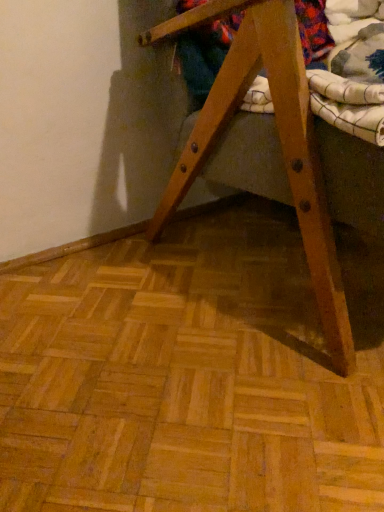
Question: Does wooden folding chair at center turn towards floral fabric at upper right?

Choices:
 (A) yes
 (B) no

Answer: (B)

Question: Does wooden folding chair at center have a larger size compared to floral fabric at upper right?

Choices:
 (A) no
 (B) yes

Answer: (B)

Question: Is wooden folding chair at center thinner than floral fabric at upper right?

Choices:
 (A) no
 (B) yes

Answer: (A)

Question: Does wooden folding chair at center have a greater height compared to floral fabric at upper right?

Choices:
 (A) no
 (B) yes

Answer: (B)

Question: Is wooden folding chair at center not within floral fabric at upper right?

Choices:
 (A) no
 (B) yes

Answer: (B)

Question: From a real-world perspective, is wooden folding chair at center located higher than floral fabric at upper right?

Choices:
 (A) no
 (B) yes

Answer: (A)

Question: Is floral fabric at upper right outside wooden folding chair at center?

Choices:
 (A) no
 (B) yes

Answer: (A)

Question: Can you confirm if floral fabric at upper right is taller than wooden folding chair at center?

Choices:
 (A) no
 (B) yes

Answer: (A)

Question: Is floral fabric at upper right thinner than wooden folding chair at center?

Choices:
 (A) yes
 (B) no

Answer: (A)

Question: From the image's perspective, would you say floral fabric at upper right is shown under wooden folding chair at center?

Choices:
 (A) yes
 (B) no

Answer: (B)

Question: Is floral fabric at upper right next to wooden folding chair at center?

Choices:
 (A) yes
 (B) no

Answer: (B)

Question: Could you tell me if floral fabric at upper right is facing wooden folding chair at center?

Choices:
 (A) no
 (B) yes

Answer: (B)

Question: Is floral fabric at upper right to the left or to the right of wooden folding chair at center in the image?

Choices:
 (A) right
 (B) left

Answer: (B)